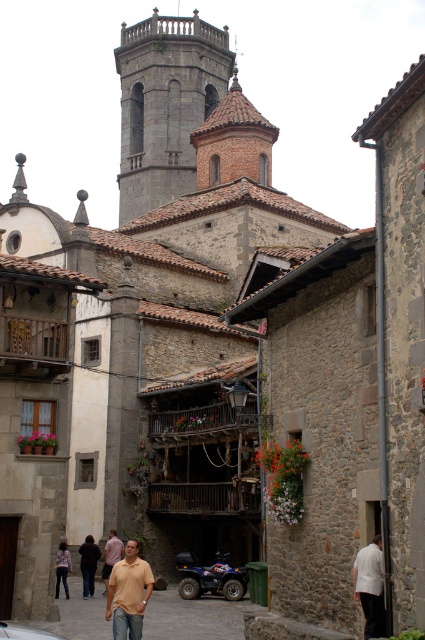
Question: Which object is the farthest from the brown stone alley at center?

Choices:
 (A) light brown shirt at center
 (B) metallic blue quad bike at center

Answer: (A)

Question: Which is nearer to the brown cotton shirt at lower left?

Choices:
 (A) dark brown leather jacket at lower left
 (B) light brown shirt at center
 (C) light brown leather jacket at lower center
 (D) white matte shirt at lower right

Answer: (A)

Question: Is metallic blue quad bike at center below light brown leather jacket at lower center?

Choices:
 (A) no
 (B) yes

Answer: (B)

Question: Which point is farther to the camera?

Choices:
 (A) (113, 634)
 (B) (95, 563)
 (C) (119, 545)
 (D) (28, 628)

Answer: (C)

Question: Can you confirm if light brown leather jacket at lower center is wider than denim pants at lower left?

Choices:
 (A) no
 (B) yes

Answer: (A)

Question: Does metallic blue quad bike at center appear on the left side of denim pants at lower left?

Choices:
 (A) no
 (B) yes

Answer: (A)